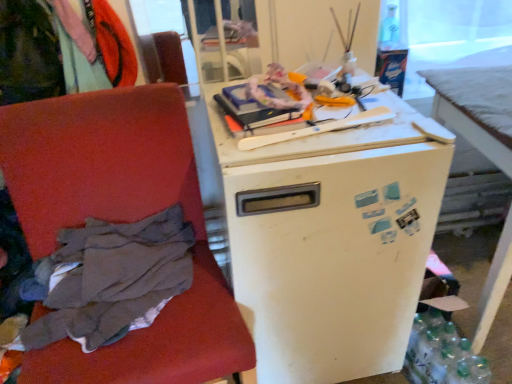
Locate an element on the screen. The width and height of the screenshot is (512, 384). vacant space in front of wooden skateboard at upper center is located at coordinates (322, 154).